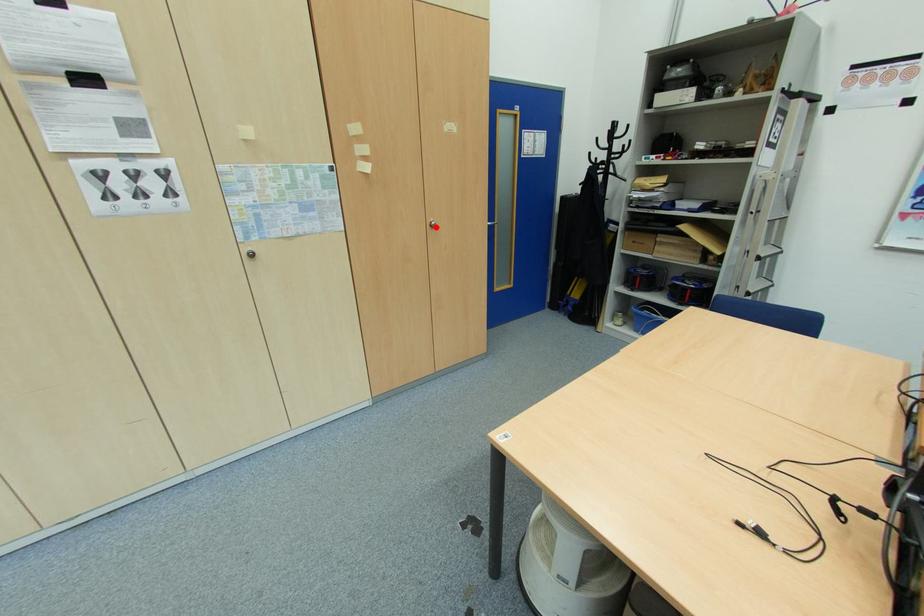
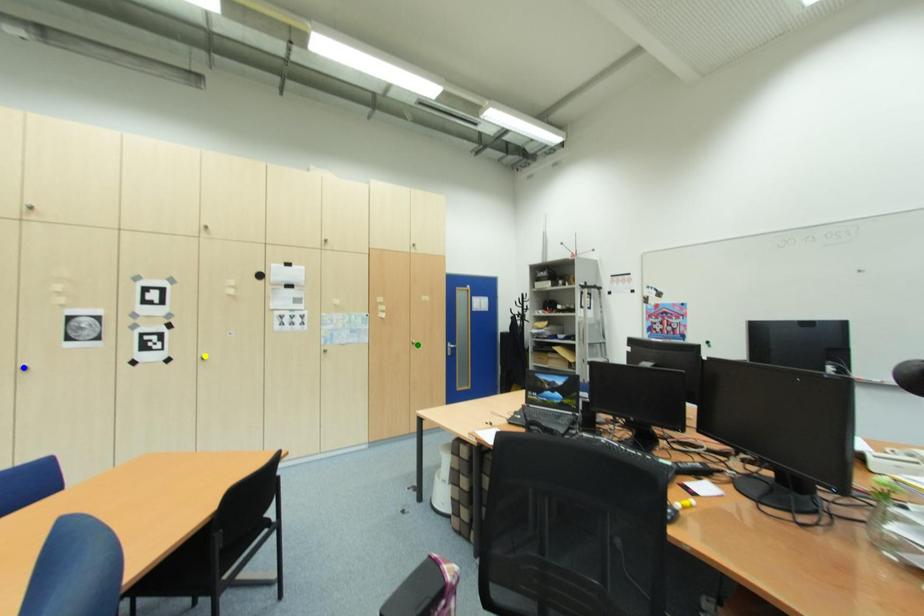
Question: I am providing you with two images of the same scene from different viewpoints. A red point is marked on the first image. You are given multiple points on the second image. Which spot in image 2 lines up with the point in image 1?

Choices:
 (A) yellow point
 (B) blue point
 (C) green point

Answer: (C)